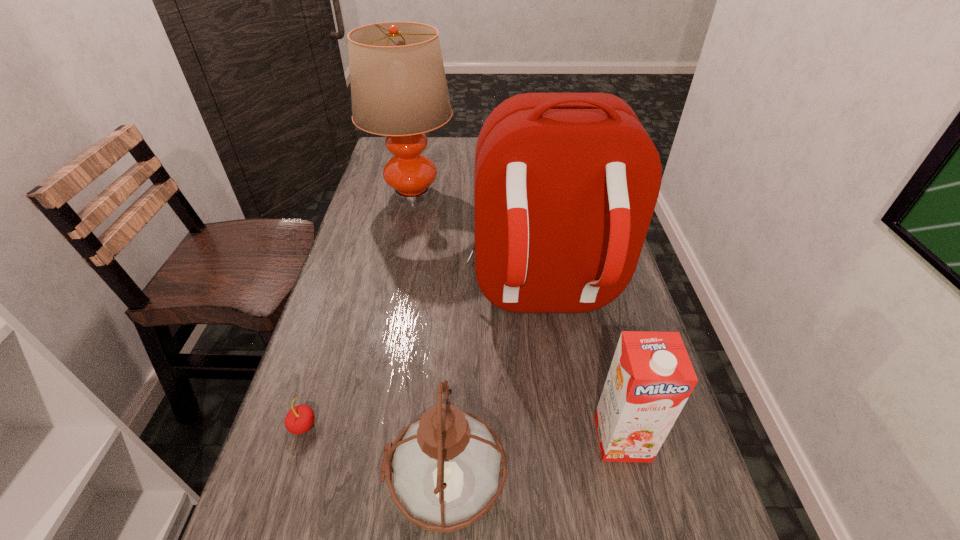
This screenshot has width=960, height=540. In order to click on vacant space that satisfies the following two spatial constraints: 1. on the strap side of the backpack; 2. on the right side of the carton in this screenshot , I will do `click(563, 438)`.